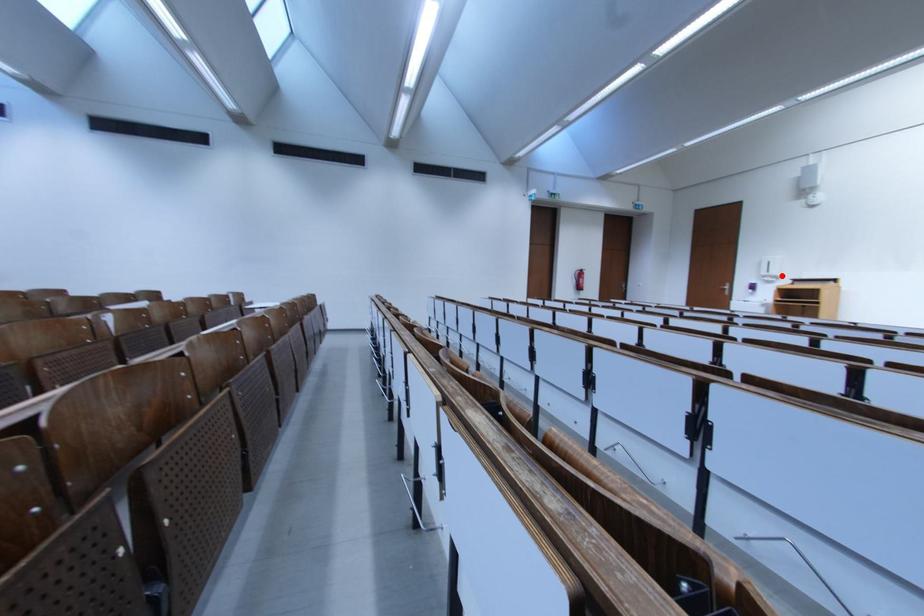
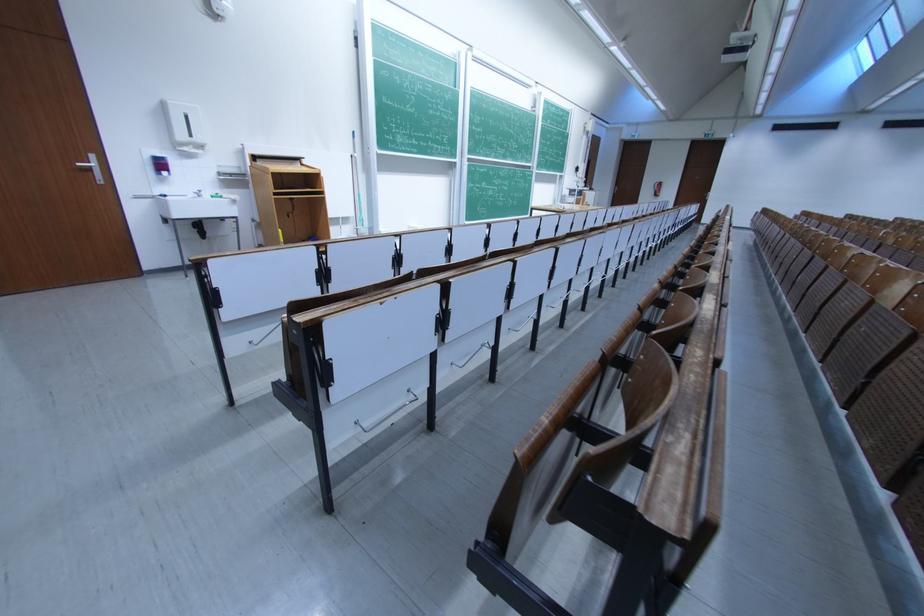
Question: I am providing you with two images of the same scene from different viewpoints. A red point is marked on the first image. At the location where the point appears in image 1, is it still visible in image 2?

Choices:
 (A) Yes
 (B) No

Answer: (A)